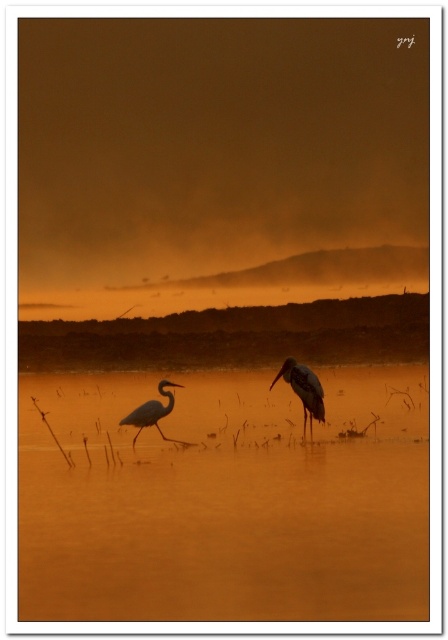
Question: Estimate the real-world distances between objects in this image. Which object is closer to the smooth gray heron at center?

Choices:
 (A) matte black heron at left
 (B) golden smooth water at center

Answer: (A)

Question: Which of the following is the closest to the observer?

Choices:
 (A) (298, 376)
 (B) (275, 593)

Answer: (B)

Question: Can you confirm if golden smooth water at center is wider than smooth gray heron at center?

Choices:
 (A) yes
 (B) no

Answer: (A)

Question: Is golden smooth water at center to the left of smooth gray heron at center from the viewer's perspective?

Choices:
 (A) no
 (B) yes

Answer: (B)

Question: In this image, where is golden smooth water at center located relative to matte black heron at left?

Choices:
 (A) below
 (B) above

Answer: (A)

Question: Which of the following is the closest to the observer?

Choices:
 (A) click(159, 404)
 (B) click(120, 429)
 (C) click(298, 364)

Answer: (C)